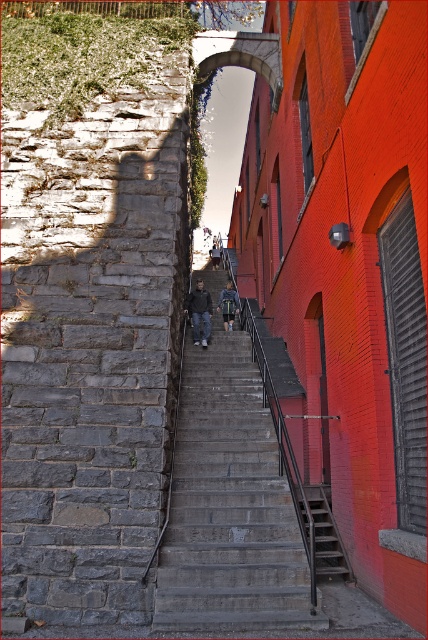
You are a photographer trying to capture both the metallic gray stairs at center and the denim jacket at center in a single frame. Since the stairs are larger, where should you position yourself to ensure both objects are clearly visible in the photo?

To capture both the metallic gray stairs at center and the denim jacket at center clearly, position yourself so that the metallic gray stairs at center is in the background and the denim jacket at center is closer to the camera. This arrangement will allow the larger stairs to fit within the frame while keeping the denim jacket at center in focus.

In the scene shown: You are standing at the bottom of the staircase in the urban scene. You notice two points marked in the image. Which point, point (348, 573) or point (208, 304), is closer to you?

Point (348, 573) is closer to the camera than point (208, 304), so the point closer to you is point (348, 573).